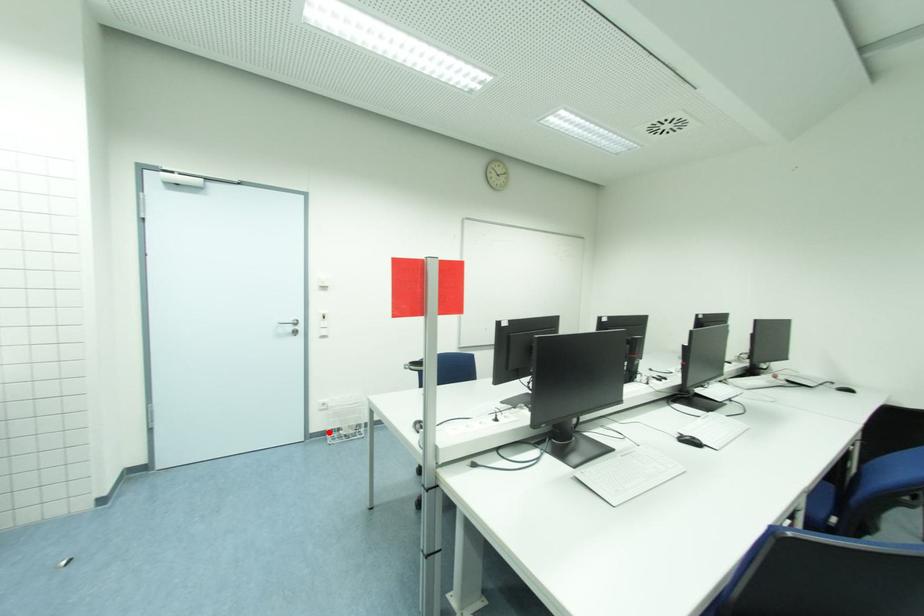
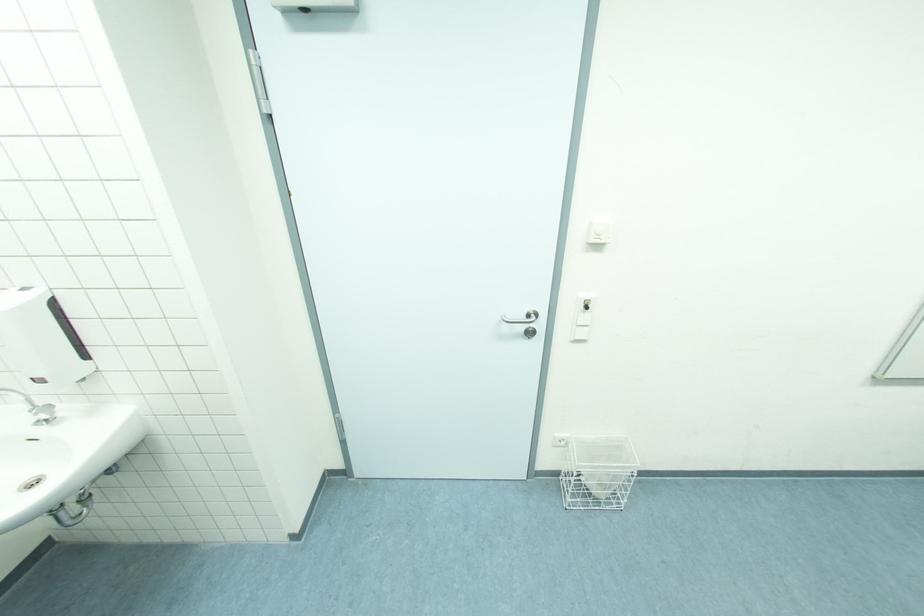
In the second image, find the point that corresponds to the highlighted location in the first image.

(563, 472)